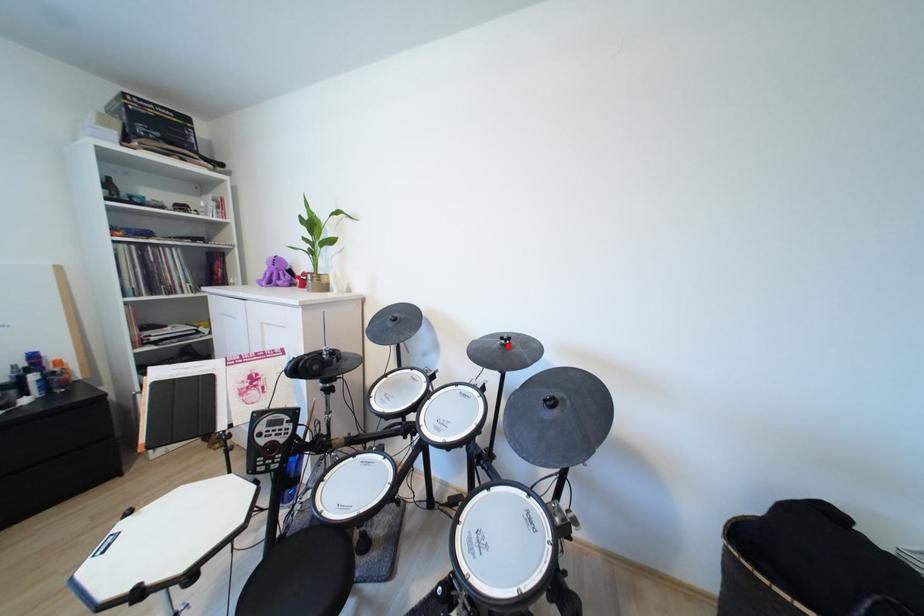
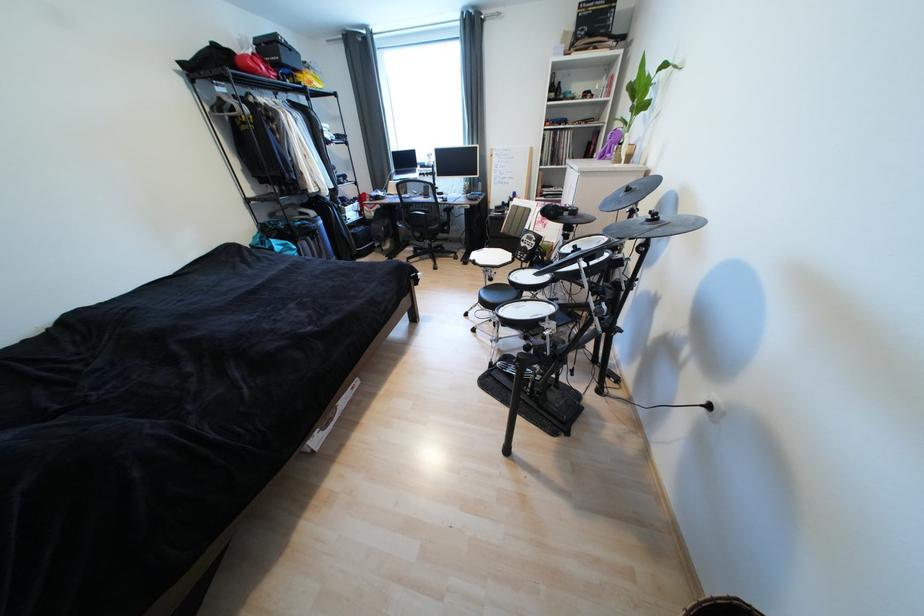
Find the pixel in the second image that matches the highlighted location in the first image.

(655, 222)